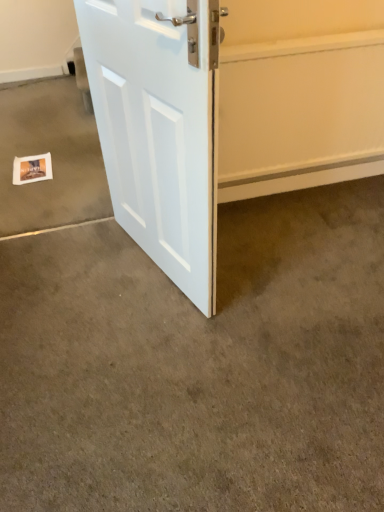
What is the approximate width of white paper postcard at lower left?

12.24 inches.

In order to click on white smooth door at upper center in this screenshot , I will do `click(300, 94)`.

Locate an element on the screen. smooth carpet at center, positioned as the second concrete in back-to-front order is located at coordinates (199, 365).

In the scene shown: Does white paper at lower left, the 2th concrete in the front-to-back sequence, have a greater height compared to white painted wood door at center?

Incorrect, the height of white paper at lower left, the 2th concrete in the front-to-back sequence, is not larger of that of white painted wood door at center.

Is point (77, 178) positioned behind point (204, 16)?

Yes, it is behind point (204, 16).

Is white paper at lower left, acting as the 1th concrete starting from the back, placed right next to white painted wood door at center?

No, white paper at lower left, acting as the 1th concrete starting from the back, is not in contact with white painted wood door at center.

From a real-world perspective, between white paper at lower left, acting as the 1th concrete starting from the back, and white painted wood door at center, who is vertically higher?

In real-world perspective, white painted wood door at center is above.

Which is more to the left, smooth carpet at center, which ranks as the 1th concrete in front-to-back order, or white smooth door at upper center?

smooth carpet at center, which ranks as the 1th concrete in front-to-back order.

Considering the sizes of objects smooth carpet at center, which ranks as the 1th concrete in front-to-back order, and white smooth door at upper center in the image provided, who is thinner, smooth carpet at center, which ranks as the 1th concrete in front-to-back order, or white smooth door at upper center?

Thinner between the two is white smooth door at upper center.

This screenshot has height=512, width=384. Identify the location of concrete that is the 1st one when counting leftward from the white smooth door at upper center. (199, 365).

Is point (181, 288) farther from viewer compared to point (27, 101)?

No.

Is white painted wood door at center to the left or to the right of white paper at lower left, acting as the 1th concrete starting from the back, in the image?

In the image, white painted wood door at center appears on the right side of white paper at lower left, acting as the 1th concrete starting from the back.

From the image's perspective, which is above, white painted wood door at center or white paper at lower left, the 2th concrete in the front-to-back sequence?

white paper at lower left, the 2th concrete in the front-to-back sequence, is shown above in the image.

Would you consider white painted wood door at center to be distant from white paper at lower left, acting as the 1th concrete starting from the back?

No, there isn't a large distance between white painted wood door at center and white paper at lower left, acting as the 1th concrete starting from the back.

Does white smooth door at upper center have a greater height compared to white paper at lower left, the 2th concrete in the front-to-back sequence?

Indeed, white smooth door at upper center has a greater height compared to white paper at lower left, the 2th concrete in the front-to-back sequence.

Can you confirm if white smooth door at upper center is smaller than white paper at lower left, the 2th concrete in the front-to-back sequence?

Yes.

Considering the relative sizes of white smooth door at upper center and white paper at lower left, acting as the 1th concrete starting from the back, in the image provided, is white smooth door at upper center thinner than white paper at lower left, acting as the 1th concrete starting from the back,?

Correct, the width of white smooth door at upper center is less than that of white paper at lower left, acting as the 1th concrete starting from the back.

Is white smooth door at upper center not within white paper postcard at lower left?

Yes.

From the image's perspective, is white smooth door at upper center located above white paper postcard at lower left?

Yes, from the image's perspective, white smooth door at upper center is above white paper postcard at lower left.

Considering the positions of point (51, 167) and point (284, 124), is point (51, 167) closer or farther from the camera than point (284, 124)?

Point (51, 167).

Considering the relative sizes of white paper postcard at lower left and white smooth door at upper center in the image provided, is white paper postcard at lower left thinner than white smooth door at upper center?

No.

From the image's perspective, is smooth carpet at center, positioned as the second concrete in back-to-front order, located above white paper postcard at lower left?

No, from the image's perspective, smooth carpet at center, positioned as the second concrete in back-to-front order, is not over white paper postcard at lower left.

From a real-world perspective, which object rests below the other?

smooth carpet at center, which ranks as the 1th concrete in front-to-back order, from a real-world perspective.

Choose the correct answer: Is smooth carpet at center, which ranks as the 1th concrete in front-to-back order, inside white paper postcard at lower left or outside it?

The correct answer is: outside.

Is smooth carpet at center, positioned as the second concrete in back-to-front order, thinner than white paper postcard at lower left?

Incorrect, the width of smooth carpet at center, positioned as the second concrete in back-to-front order, is not less than that of white paper postcard at lower left.

The width and height of the screenshot is (384, 512). What are the coordinates of `door in front of the white paper at lower left, acting as the 1th concrete starting from the back` in the screenshot? It's located at (160, 128).

This screenshot has width=384, height=512. What are the coordinates of `garage door above the smooth carpet at center, positioned as the second concrete in back-to-front order (from a real-world perspective)` in the screenshot? It's located at (300, 94).

Looking at the image, which one is located further to white painted wood door at center, white smooth door at upper center or smooth carpet at center, positioned as the second concrete in back-to-front order?

The object further to white painted wood door at center is white smooth door at upper center.

Based on their spatial positions, is white paper postcard at lower left or white smooth door at upper center further from white painted wood door at center?

white paper postcard at lower left is further to white painted wood door at center.

Estimate the real-world distances between objects in this image. Which object is closer to white paper postcard at lower left, white paper at lower left, acting as the 1th concrete starting from the back, or white smooth door at upper center?

Based on the image, white paper at lower left, acting as the 1th concrete starting from the back, appears to be nearer to white paper postcard at lower left.

From the picture: From the image, which object appears to be farther from white smooth door at upper center, white painted wood door at center or smooth carpet at center, which ranks as the 1th concrete in front-to-back order?

The object further to white smooth door at upper center is smooth carpet at center, which ranks as the 1th concrete in front-to-back order.

Which object lies further to the anchor point white painted wood door at center, smooth carpet at center, which ranks as the 1th concrete in front-to-back order, or white smooth door at upper center?

Based on the image, white smooth door at upper center appears to be further to white painted wood door at center.

Which object lies further to the anchor point white paper at lower left, the 2th concrete in the front-to-back sequence, white smooth door at upper center or white paper postcard at lower left?

Based on the image, white smooth door at upper center appears to be further to white paper at lower left, the 2th concrete in the front-to-back sequence.

Considering their positions, is white painted wood door at center positioned closer to smooth carpet at center, positioned as the second concrete in back-to-front order, than white paper at lower left, the 2th concrete in the front-to-back sequence?

white painted wood door at center is closer to smooth carpet at center, positioned as the second concrete in back-to-front order.

Considering their positions, is white paper at lower left, acting as the 1th concrete starting from the back, positioned further to white painted wood door at center than white smooth door at upper center?

white paper at lower left, acting as the 1th concrete starting from the back, is positioned further to the anchor white painted wood door at center.

In order to click on concrete situated between white paper at lower left, the 2th concrete in the front-to-back sequence, and white smooth door at upper center from left to right in this screenshot , I will do `click(199, 365)`.

In order to click on door between white smooth door at upper center and smooth carpet at center, positioned as the second concrete in back-to-front order, from top to bottom in this screenshot , I will do `click(160, 128)`.

In order to click on concrete between smooth carpet at center, which ranks as the 1th concrete in front-to-back order, and white paper postcard at lower left, along the z-axis in this screenshot , I will do `click(51, 157)`.

Find the location of `garage door positioned between white painted wood door at center and white paper postcard at lower left from near to far`. garage door positioned between white painted wood door at center and white paper postcard at lower left from near to far is located at coordinates (300, 94).